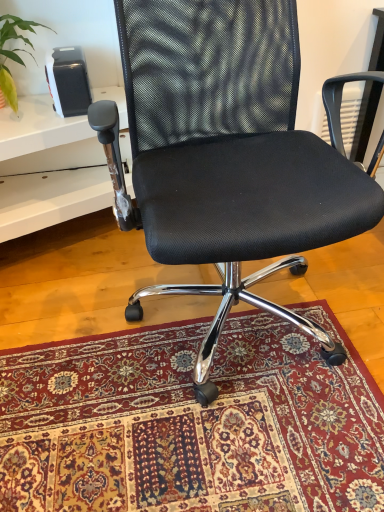
Where is `vacant region below green leafy plant at upper left (from a real-world perspective)`? vacant region below green leafy plant at upper left (from a real-world perspective) is located at coordinates (27, 111).